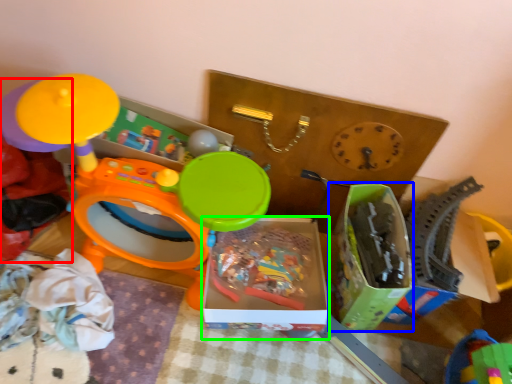
Question: Based on their relative distances, which object is farther from toy (highlighted by a red box)? Choose from storage box (highlighted by a blue box) and storage box (highlighted by a green box).

Choices:
 (A) storage box
 (B) storage box

Answer: (A)